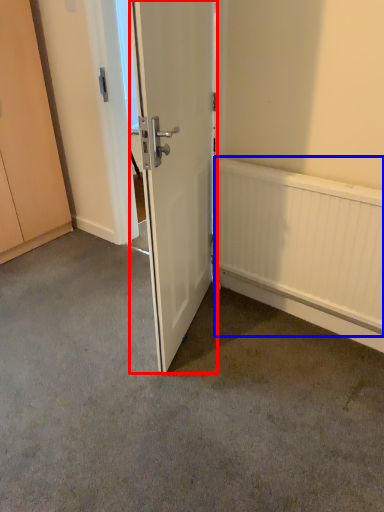
Question: Which object appears closest to the camera in this image, door (highlighted by a red box) or radiator (highlighted by a blue box)?

Choices:
 (A) door
 (B) radiator

Answer: (A)